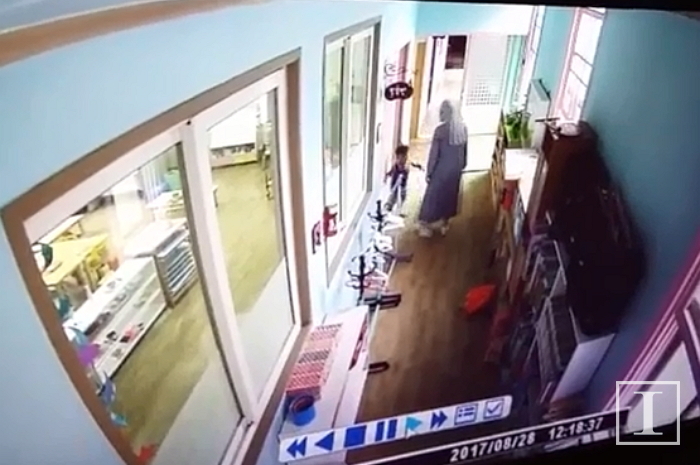
The height and width of the screenshot is (465, 700). I want to click on window, so click(186, 342), click(273, 251), click(334, 145), click(356, 137), click(578, 70), click(532, 47).